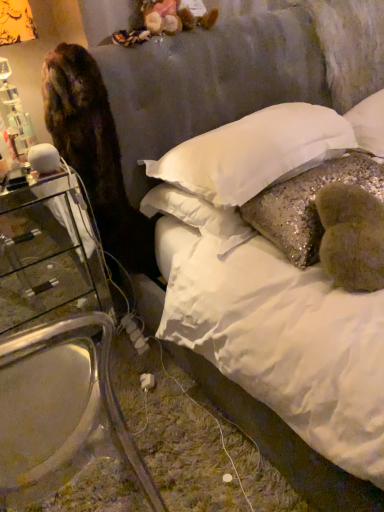
Question: Is glittery sequined pillow at center, positioned as the second pillow in right-to-left order, wider or thinner than white soft pillow at upper center, which appears as the 1th pillow when viewed from the right?

Choices:
 (A) thin
 (B) wide

Answer: (A)

Question: From the image's perspective, is glittery sequined pillow at center, positioned as the second pillow in right-to-left order, above or below white soft pillow at upper center, the 3th pillow viewed from the left?

Choices:
 (A) above
 (B) below

Answer: (B)

Question: Which is farther from the brown fur cat at left?

Choices:
 (A) glittery sequined pillow at center, the 2th pillow positioned from the left
 (B) transparent glass armchair at left
 (C) white sequined pillow at center, which is counted as the 3th pillow, starting from the right
 (D) white soft pillow at upper center, which appears as the 1th pillow when viewed from the right
 (E) clear glass nightstand at left

Answer: (D)

Question: Which is farther from the glittery sequined pillow at center, positioned as the second pillow in right-to-left order?

Choices:
 (A) brown fur cat at left
 (B) transparent glass armchair at left
 (C) white sequined pillow at center, the 1th pillow in the left-to-right sequence
 (D) white soft pillow at upper center, the 3th pillow viewed from the left
 (E) clear glass nightstand at left

Answer: (E)